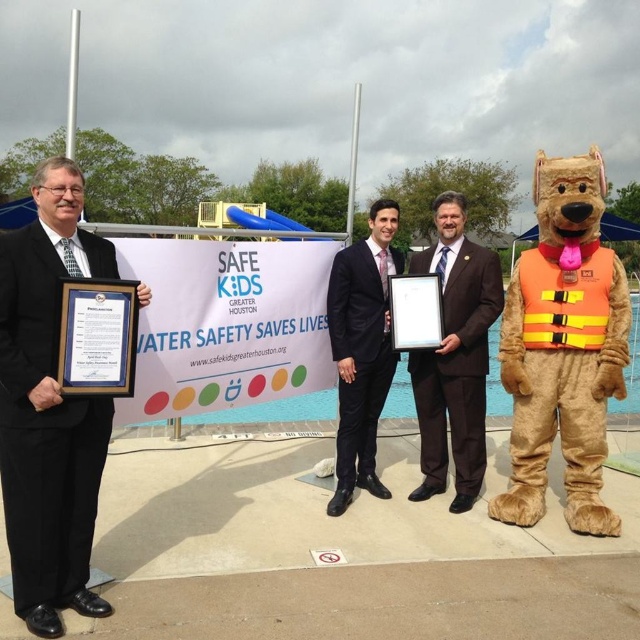
Question: Which point is closer to the camera?

Choices:
 (A) (17, 595)
 (B) (444, 413)
 (C) (614, 536)

Answer: (A)

Question: Observing the image, what is the correct spatial positioning of fuzzy brown teddy bear at right in reference to black suit at center?

Choices:
 (A) above
 (B) below

Answer: (A)

Question: Can you confirm if fuzzy brown teddy bear at right is positioned to the right of black suit at center?

Choices:
 (A) yes
 (B) no

Answer: (A)

Question: Considering the real-world distances, which object is closest to the brown suit at center?

Choices:
 (A) black suit at center
 (B) black matte suit at left
 (C) fuzzy brown teddy bear at right

Answer: (A)

Question: Which object is the farthest from the fuzzy brown teddy bear at right?

Choices:
 (A) black suit at center
 (B) brown suit at center

Answer: (A)

Question: Can you confirm if black matte suit at left is positioned to the right of fuzzy brown teddy bear at right?

Choices:
 (A) no
 (B) yes

Answer: (A)